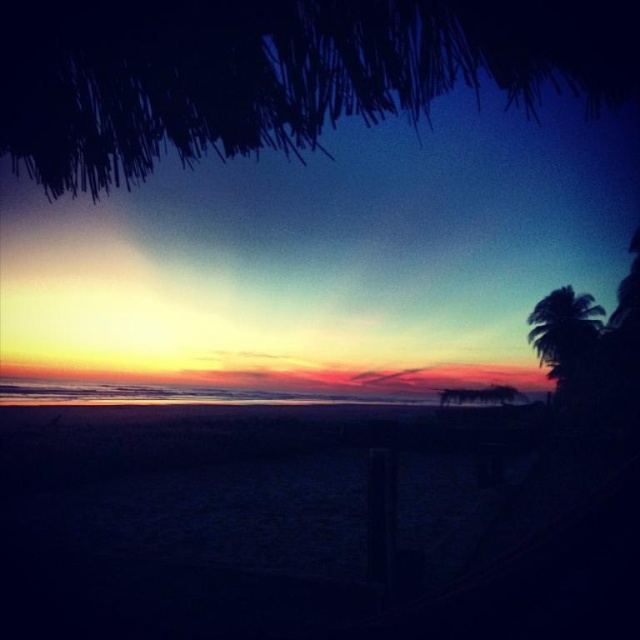
Can you confirm if dark sand at lower center is shorter than silhouette leafy palm at right?

Yes.

Describe the element at coordinates (310, 524) in the screenshot. I see `dark sand at lower center` at that location.

Which is behind, point (54, 524) or point (552, 349)?

Point (552, 349)

What are the coordinates of `dark sand at lower center` in the screenshot? It's located at (310, 524).